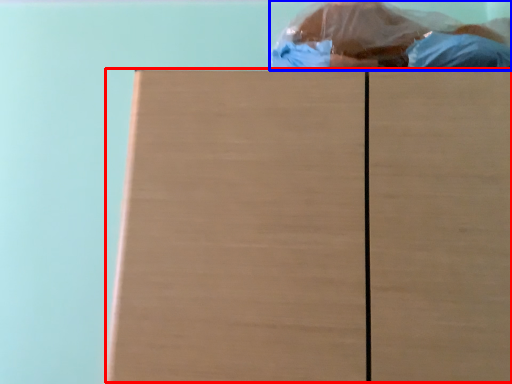
Question: Among these objects, which one is farthest to the camera, wood (highlighted by a red box) or person (highlighted by a blue box)?

Choices:
 (A) wood
 (B) person

Answer: (B)